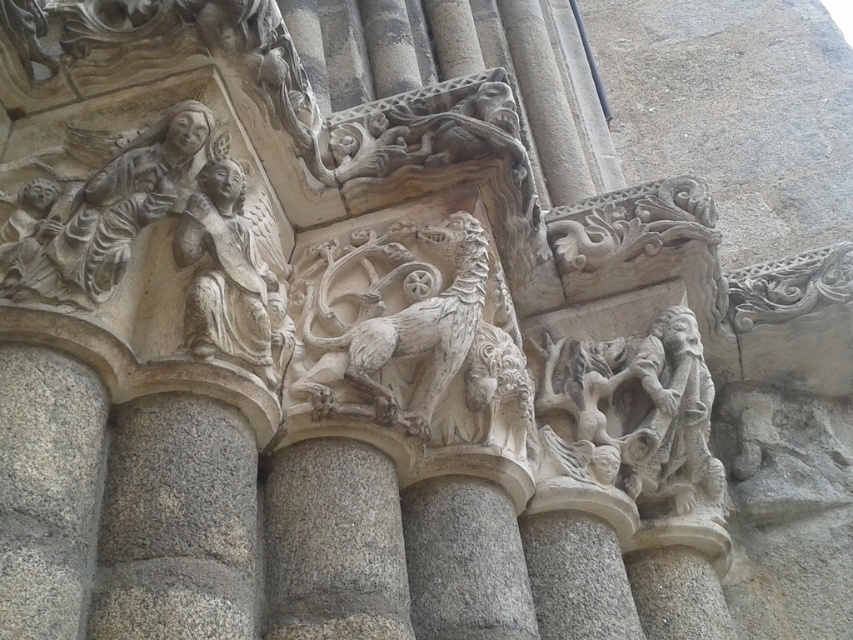
This screenshot has width=853, height=640. I want to click on gray stone pillar at center, so click(334, 545).

Where is `gray stone pillar at center`? gray stone pillar at center is located at coordinates (334, 545).

Who is positioned more to the left, carved stone figure at center or gray stone relief at upper left?

gray stone relief at upper left

Can you confirm if carved stone figure at center is wider than gray stone relief at upper left?

Yes.

Find the location of a particular element. Image resolution: width=853 pixels, height=640 pixels. carved stone figure at center is located at coordinates (641, 406).

You are a GUI agent. You are given a task and a screenshot of the screen. Output one action in this format:
    pyautogui.click(x=<x>, y=<y>)
    Task: Click on the carved stone figure at center
    Image resolution: width=853 pixels, height=640 pixels.
    Given the screenshot: What is the action you would take?
    pyautogui.click(x=641, y=406)

Between gray stone relief at upper left and white stone lion at center, which one is positioned lower?

white stone lion at center is below.

Is gray stone relief at upper left further to the viewer compared to white stone lion at center?

No.

Identify the location of gray stone relief at upper left. Image resolution: width=853 pixels, height=640 pixels. (111, 214).

Locate an element on the screen. This screenshot has width=853, height=640. gray stone relief at upper left is located at coordinates (111, 214).